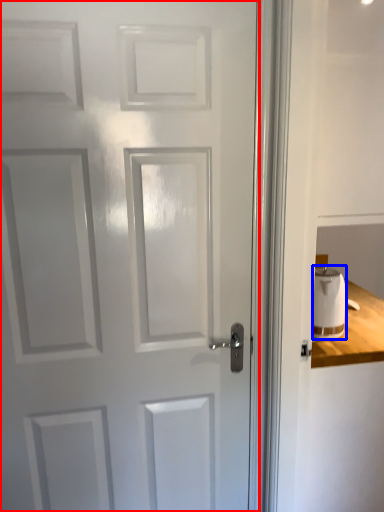
Question: Which object appears farthest to the camera in this image, door (highlighted by a red box) or toilet paper (highlighted by a blue box)?

Choices:
 (A) door
 (B) toilet paper

Answer: (B)